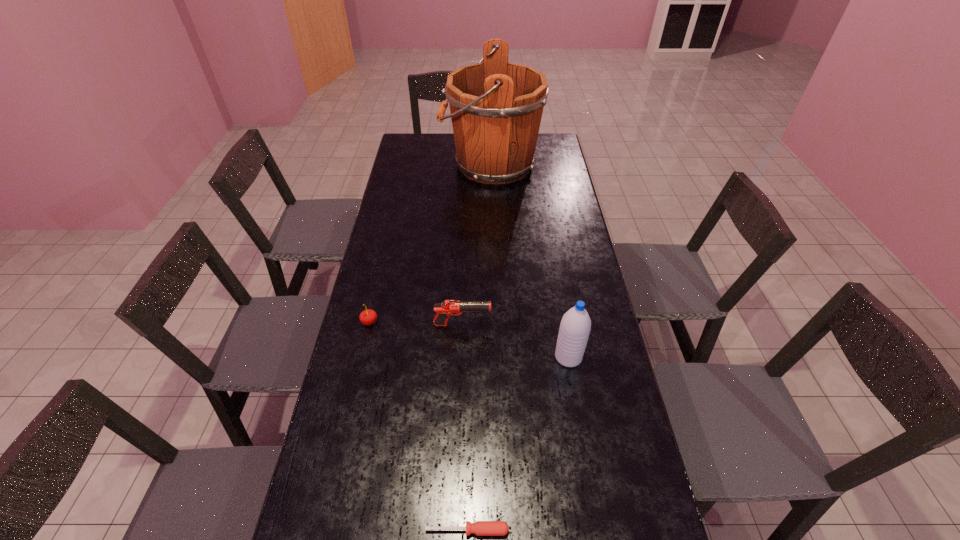
You are a GUI agent. You are given a task and a screenshot of the screen. Output one action in this format:
    pyautogui.click(x=<x>, y=<y>)
    Task: Click on the free space between the second nearest object and the farthest object
    
    Given the screenshot: What is the action you would take?
    pyautogui.click(x=529, y=261)

Find the location of a particular element. This screenshot has height=540, width=960. vacant space in between the gun and the second nearest object is located at coordinates (516, 341).

At what (x,y) coordinates should I click in order to perform the action: click on empty location between the gun and the farthest object. Please return your answer as a coordinate pair (x, y). This screenshot has height=540, width=960. Looking at the image, I should click on (476, 245).

This screenshot has width=960, height=540. What are the coordinates of `free space between the leftmost object and the bucket` in the screenshot? It's located at click(430, 243).

Where is `free space between the gun and the screwdriver`? This screenshot has height=540, width=960. free space between the gun and the screwdriver is located at coordinates (465, 427).

Where is `object that is the fourth closest to the shortest object`? object that is the fourth closest to the shortest object is located at coordinates tap(496, 107).

I want to click on the third closest object relative to the fourth shortest object, so click(x=367, y=317).

At what (x,y) coordinates should I click in order to perform the action: click on free location that satisfies the following two spatial constraints: 1. with the handle on the side of the water bottle; 2. on the right side of the farthest object. Please return your answer as a coordinate pair (x, y). This screenshot has height=540, width=960. Looking at the image, I should click on (496, 357).

In order to click on vacant point that satisfies the following two spatial constraints: 1. at the aiming end of the fourth shortest object; 2. on the left side of the gun in this screenshot , I will do `click(461, 357)`.

This screenshot has width=960, height=540. I want to click on free point that satisfies the following two spatial constraints: 1. at the aiming end of the gun; 2. on the right side of the nearest object, so click(455, 530).